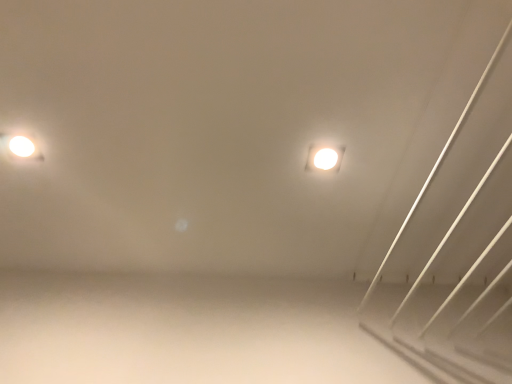
Identify the location of white glossy light fixture at upper center, acting as the 2th lamp starting from the left. This screenshot has height=384, width=512. (324, 158).

This screenshot has height=384, width=512. Describe the element at coordinates (324, 158) in the screenshot. I see `white glossy light fixture at upper center, the 1th lamp when ordered from right to left` at that location.

Measure the distance between white glossy light fixture at upper center, acting as the 2th lamp starting from the left, and camera.

A distance of 3.55 feet exists between white glossy light fixture at upper center, acting as the 2th lamp starting from the left, and camera.

This screenshot has width=512, height=384. What do you see at coordinates (19, 148) in the screenshot?
I see `matte white light fixture at upper left, which is the first lamp in left-to-right order` at bounding box center [19, 148].

At what (x,y) coordinates should I click in order to perform the action: click on matte white light fixture at upper left, which ranks as the second lamp in right-to-left order. Please return your answer as a coordinate pair (x, y). This screenshot has height=384, width=512. Looking at the image, I should click on (19, 148).

Find the location of a particular element. white glossy light fixture at upper center, acting as the 2th lamp starting from the left is located at coordinates (324, 158).

Would you say matte white light fixture at upper left, which is the first lamp in left-to-right order, is to the left or to the right of white glossy light fixture at upper center, the 1th lamp when ordered from right to left, in the picture?

matte white light fixture at upper left, which is the first lamp in left-to-right order, is to the left of white glossy light fixture at upper center, the 1th lamp when ordered from right to left.

Which object is closer to the camera, matte white light fixture at upper left, which ranks as the second lamp in right-to-left order, or white glossy light fixture at upper center, acting as the 2th lamp starting from the left?

matte white light fixture at upper left, which ranks as the second lamp in right-to-left order, is more forward.

Which is in front, point (12, 146) or point (341, 146)?

The point (341, 146) is closer to the camera.

From the image's perspective, which object appears higher, matte white light fixture at upper left, which is the first lamp in left-to-right order, or white glossy light fixture at upper center, acting as the 2th lamp starting from the left?

matte white light fixture at upper left, which is the first lamp in left-to-right order.

Based on the photo, from a real-world perspective, which object stands above the other?

matte white light fixture at upper left, which is the first lamp in left-to-right order, is physically above.

Considering the relative sizes of matte white light fixture at upper left, which ranks as the second lamp in right-to-left order, and white glossy light fixture at upper center, acting as the 2th lamp starting from the left, in the image provided, is matte white light fixture at upper left, which ranks as the second lamp in right-to-left order, wider than white glossy light fixture at upper center, acting as the 2th lamp starting from the left,?

No.

Between matte white light fixture at upper left, which ranks as the second lamp in right-to-left order, and white glossy light fixture at upper center, acting as the 2th lamp starting from the left, which one has more height?

matte white light fixture at upper left, which ranks as the second lamp in right-to-left order, is taller.

Is matte white light fixture at upper left, which ranks as the second lamp in right-to-left order, bigger than white glossy light fixture at upper center, acting as the 2th lamp starting from the left?

Yes, matte white light fixture at upper left, which ranks as the second lamp in right-to-left order, is bigger than white glossy light fixture at upper center, acting as the 2th lamp starting from the left.

Is matte white light fixture at upper left, which ranks as the second lamp in right-to-left order, outside of white glossy light fixture at upper center, the 1th lamp when ordered from right to left?

Absolutely, matte white light fixture at upper left, which ranks as the second lamp in right-to-left order, is external to white glossy light fixture at upper center, the 1th lamp when ordered from right to left.

Is there a large distance between matte white light fixture at upper left, which is the first lamp in left-to-right order, and white glossy light fixture at upper center, acting as the 2th lamp starting from the left?

No, matte white light fixture at upper left, which is the first lamp in left-to-right order, is not far from white glossy light fixture at upper center, acting as the 2th lamp starting from the left.

Does matte white light fixture at upper left, which is the first lamp in left-to-right order, turn towards white glossy light fixture at upper center, acting as the 2th lamp starting from the left?

Yes.

Image resolution: width=512 pixels, height=384 pixels. Identify the location of lamp that is on the right side of matte white light fixture at upper left, which is the first lamp in left-to-right order. click(x=324, y=158).

Considering the positions of objects white glossy light fixture at upper center, the 1th lamp when ordered from right to left, and matte white light fixture at upper left, which is the first lamp in left-to-right order, in the image provided, who is more to the right, white glossy light fixture at upper center, the 1th lamp when ordered from right to left, or matte white light fixture at upper left, which is the first lamp in left-to-right order,?

From the viewer's perspective, white glossy light fixture at upper center, the 1th lamp when ordered from right to left, appears more on the right side.

Is white glossy light fixture at upper center, acting as the 2th lamp starting from the left, positioned before matte white light fixture at upper left, which ranks as the second lamp in right-to-left order?

That is False.

Which point is more distant from viewer, (331, 162) or (14, 136)?

The point (331, 162) is farther.

From the image's perspective, which object appears higher, white glossy light fixture at upper center, acting as the 2th lamp starting from the left, or matte white light fixture at upper left, which ranks as the second lamp in right-to-left order?

matte white light fixture at upper left, which ranks as the second lamp in right-to-left order.

From a real-world perspective, does white glossy light fixture at upper center, acting as the 2th lamp starting from the left, sit lower than matte white light fixture at upper left, which ranks as the second lamp in right-to-left order?

Yes.

Which object is thinner, white glossy light fixture at upper center, the 1th lamp when ordered from right to left, or matte white light fixture at upper left, which ranks as the second lamp in right-to-left order?

matte white light fixture at upper left, which ranks as the second lamp in right-to-left order, is thinner.

Considering the relative sizes of white glossy light fixture at upper center, acting as the 2th lamp starting from the left, and matte white light fixture at upper left, which ranks as the second lamp in right-to-left order, in the image provided, is white glossy light fixture at upper center, acting as the 2th lamp starting from the left, taller than matte white light fixture at upper left, which ranks as the second lamp in right-to-left order,?

No.

Who is bigger, white glossy light fixture at upper center, the 1th lamp when ordered from right to left, or matte white light fixture at upper left, which is the first lamp in left-to-right order?

matte white light fixture at upper left, which is the first lamp in left-to-right order, is bigger.

Is white glossy light fixture at upper center, acting as the 2th lamp starting from the left, not within matte white light fixture at upper left, which ranks as the second lamp in right-to-left order?

Yes, white glossy light fixture at upper center, acting as the 2th lamp starting from the left, is located beyond the bounds of matte white light fixture at upper left, which ranks as the second lamp in right-to-left order.

Are white glossy light fixture at upper center, the 1th lamp when ordered from right to left, and matte white light fixture at upper left, which is the first lamp in left-to-right order, beside each other?

No, white glossy light fixture at upper center, the 1th lamp when ordered from right to left, is not next to matte white light fixture at upper left, which is the first lamp in left-to-right order.

Could you tell me if white glossy light fixture at upper center, the 1th lamp when ordered from right to left, is turned towards matte white light fixture at upper left, which is the first lamp in left-to-right order?

Yes, white glossy light fixture at upper center, the 1th lamp when ordered from right to left, is facing matte white light fixture at upper left, which is the first lamp in left-to-right order.

How many degrees apart are the facing directions of white glossy light fixture at upper center, acting as the 2th lamp starting from the left, and matte white light fixture at upper left, which is the first lamp in left-to-right order?

white glossy light fixture at upper center, acting as the 2th lamp starting from the left, and matte white light fixture at upper left, which is the first lamp in left-to-right order, are facing 179 degrees away from each other.

How distant is white glossy light fixture at upper center, acting as the 2th lamp starting from the left, from matte white light fixture at upper left, which is the first lamp in left-to-right order?

A distance of 29.26 inches exists between white glossy light fixture at upper center, acting as the 2th lamp starting from the left, and matte white light fixture at upper left, which is the first lamp in left-to-right order.

The image size is (512, 384). What are the coordinates of `lamp that appears on the right of matte white light fixture at upper left, which is the first lamp in left-to-right order` in the screenshot? It's located at (324, 158).

Where is `lamp located above the white glossy light fixture at upper center, the 1th lamp when ordered from right to left (from a real-world perspective)`? The image size is (512, 384). lamp located above the white glossy light fixture at upper center, the 1th lamp when ordered from right to left (from a real-world perspective) is located at coordinates (19, 148).

I want to click on lamp located underneath the matte white light fixture at upper left, which is the first lamp in left-to-right order (from a real-world perspective), so click(x=324, y=158).